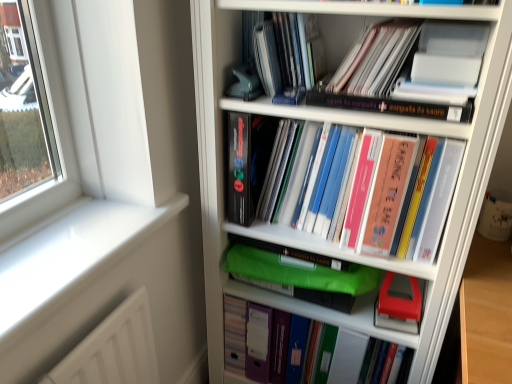
Question: Based on their positions, is matte pink paper at upper center, the fourth book ordered from the bottom, located to the left or right of hardcover book at center, marked as the 2th book in a bottom-to-top arrangement?

Choices:
 (A) left
 (B) right

Answer: (B)

Question: From a real-world perspective, is matte pink paper at upper center, the fourth book ordered from the bottom, positioned above or below hardcover book at center, the fourth book viewed from the top?

Choices:
 (A) below
 (B) above

Answer: (B)

Question: Which object is positioned closest to the red matte stapler at center?

Choices:
 (A) white glossy window sill at left
 (B) matte pink paper at upper center, the fourth book ordered from the bottom
 (C) matte black book at upper center, which is the 1th book from top to bottom
 (D) white plastic bookcase at center
 (E) hardcover book at center, marked as the 2th book in a bottom-to-top arrangement

Answer: (E)

Question: Which is farther from the hardcover book at center, the fourth book viewed from the top?

Choices:
 (A) matte black book at upper center, which is the 1th book from top to bottom
 (B) red matte stapler at center
 (C) white glossy window sill at left
 (D) hardcover book at upper center, positioned as the 3th book in bottom-to-top order
 (E) green plastic folder at center, arranged as the 1th book when ordered from the bottom

Answer: (C)